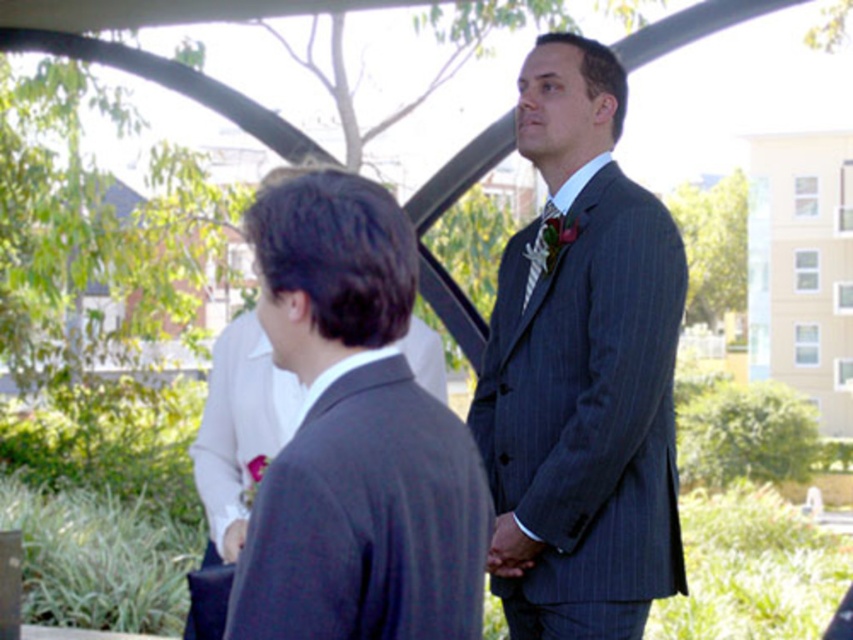
Is dark gray suit at center further to camera compared to striped silk tie at center?

No, dark gray suit at center is closer to the viewer.

Which is in front, point (318, 374) or point (532, 250)?

Point (318, 374)

Does point (433, 452) come behind point (534, 237)?

No, it is in front of (534, 237).

You are a GUI agent. You are given a task and a screenshot of the screen. Output one action in this format:
    pyautogui.click(x=<x>, y=<y>)
    Task: Click on the dark gray suit at center
    Image resolution: width=853 pixels, height=640 pixels.
    Given the screenshot: What is the action you would take?
    pyautogui.click(x=355, y=436)

Which is above, pinstriped suit at center or dark gray suit at center?

pinstriped suit at center is higher up.

Does pinstriped suit at center have a larger size compared to dark gray suit at center?

Yes.

I want to click on pinstriped suit at center, so click(x=582, y=371).

Where is `pinstriped suit at center`? This screenshot has width=853, height=640. pinstriped suit at center is located at coordinates (582, 371).

Does pinstriped suit at center lie behind striped silk tie at center?

No, it is in front of striped silk tie at center.

Does pinstriped suit at center appear over striped silk tie at center?

Incorrect, pinstriped suit at center is not positioned above striped silk tie at center.

The height and width of the screenshot is (640, 853). Describe the element at coordinates (582, 371) in the screenshot. I see `pinstriped suit at center` at that location.

The image size is (853, 640). Identify the location of pinstriped suit at center. (582, 371).